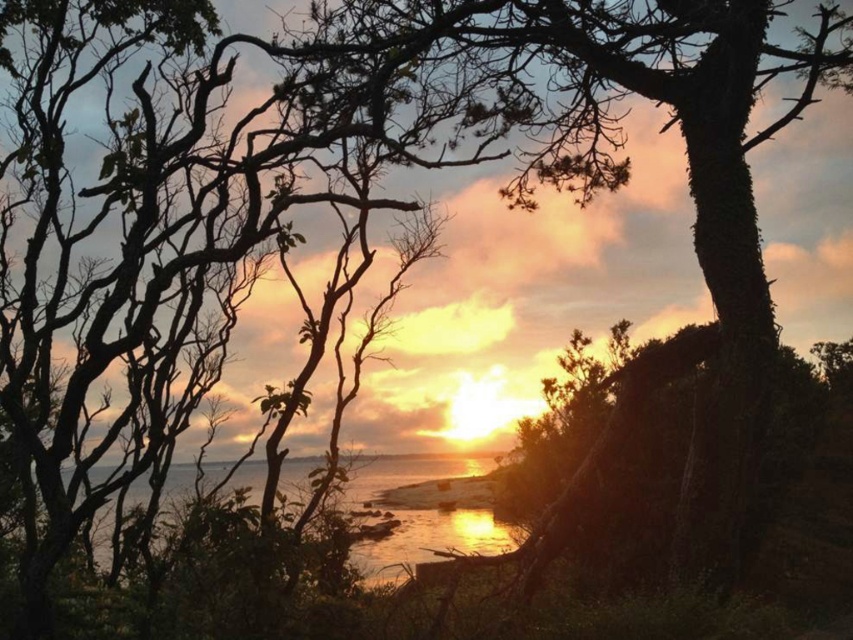
You are standing at the point marked as point (553,49) in the coastal sunset scene. A friend is located exactly where you are. You both decide to walk towards the distant horizon line. Since you are both at the same starting point, will you both reach the horizon at the same time?

Yes, both you and your friend will reach the horizon at the same time since you are starting from the same point (553,49) and moving towards the same direction.

You are an artist planning to sketch this sunset scene. You want to focus on the green mossy tree at center and the shiny metallic water at center. Which of these two elements should you draw first if you want to prioritize the larger one in your composition?

The shiny metallic water at center occupies more space than the green mossy tree at center, so you should draw the shiny metallic water at center first to prioritize the larger element in your composition.

You are standing at the center of the image and want to take a photo of the green mossy tree at center. Which direction should you move to get a better view of the tree?

Since the green mossy tree at center is already at the center of the image, you don not need to move in any direction to get a better view of it.